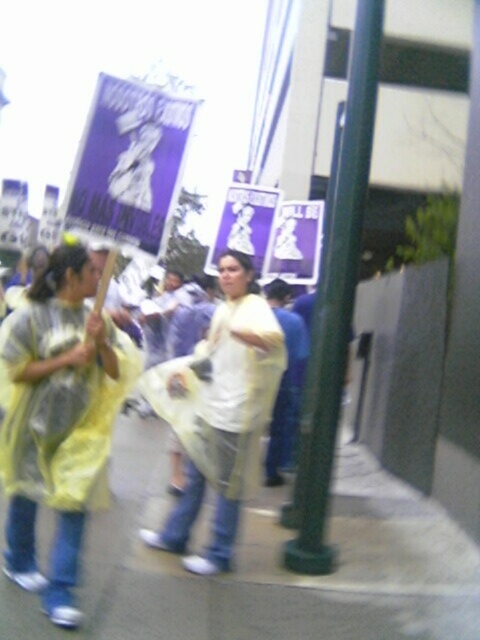
Question: From the image, what is the correct spatial relationship of green metallic pole at center in relation to white t-shirt at center?

Choices:
 (A) right
 (B) left

Answer: (A)

Question: Which of the following is the closest to the observer?

Choices:
 (A) pyautogui.click(x=282, y=422)
 (B) pyautogui.click(x=309, y=556)
 (C) pyautogui.click(x=175, y=620)
 (D) pyautogui.click(x=247, y=456)

Answer: (C)

Question: Does smooth concrete pavement at lower center have a lesser width compared to yellow plastic poncho at left?

Choices:
 (A) yes
 (B) no

Answer: (B)

Question: Which of these objects is positioned closest to the green metallic pole at center?

Choices:
 (A) white t-shirt at center
 (B) yellow plastic poncho at left
 (C) smooth concrete pavement at lower center

Answer: (C)

Question: Can you confirm if green metallic pole at center is smaller than white matte shirt at center?

Choices:
 (A) no
 (B) yes

Answer: (A)

Question: Which object appears farthest from the camera in this image?

Choices:
 (A) green metallic pole at center
 (B) yellow plastic poncho at left
 (C) smooth concrete pavement at lower center
 (D) white matte shirt at center

Answer: (A)